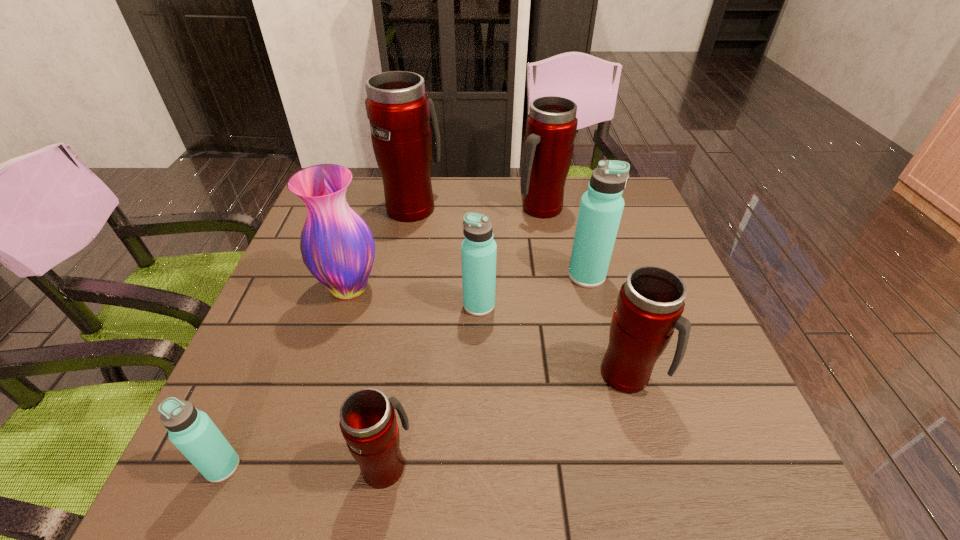
This screenshot has width=960, height=540. In order to click on the biggest red thermos bottle in this screenshot , I will do `click(405, 136)`.

At what (x,y) coordinates should I click in order to perform the action: click on the tallest thermos bottle. Please return your answer as a coordinate pair (x, y). This screenshot has width=960, height=540. Looking at the image, I should click on (405, 136).

Locate an element on the screen. the biggest aqua thermos bottle is located at coordinates (x=601, y=207).

Find the location of `the farthest aqua thermos bottle`. the farthest aqua thermos bottle is located at coordinates tap(601, 207).

This screenshot has height=540, width=960. I want to click on the second biggest red thermos bottle, so click(x=551, y=125).

The height and width of the screenshot is (540, 960). Identify the location of purple vase. (337, 246).

This screenshot has width=960, height=540. I want to click on the fourth object from right to left, so click(478, 250).

In order to click on the second aqua thermos bottle from right to left in this screenshot , I will do `click(478, 250)`.

At what (x,y) coordinates should I click in order to perform the action: click on the third nearest thermos bottle. Please return your answer as a coordinate pair (x, y). The height and width of the screenshot is (540, 960). Looking at the image, I should click on (650, 303).

This screenshot has height=540, width=960. Identify the location of the third farthest red thermos bottle. (650, 303).